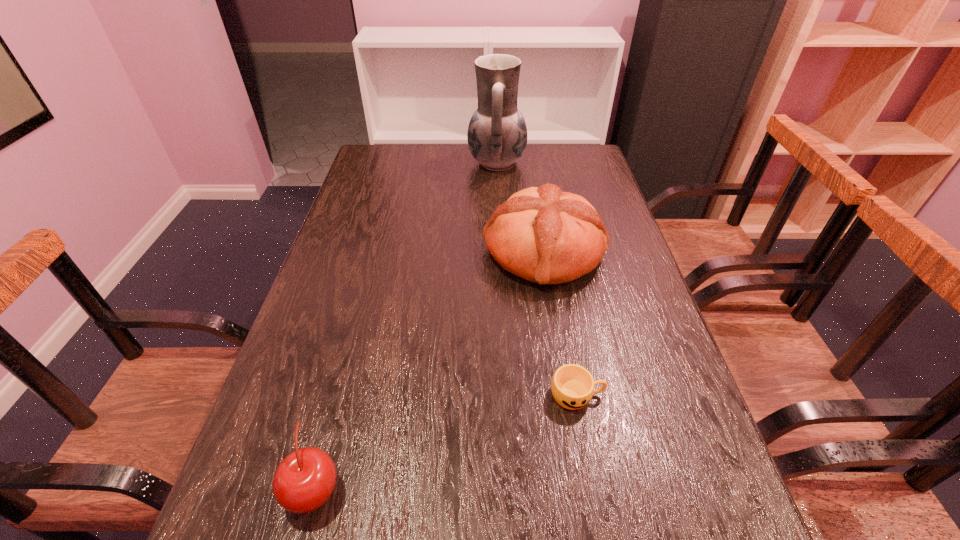
The height and width of the screenshot is (540, 960). Identify the location of vacant region that satisfies the following two spatial constraints: 1. on the back side of the second tallest object; 2. on the left side of the nearest object. (377, 252).

Find the location of a particular element. free space that satisfies the following two spatial constraints: 1. on the front-facing side of the cup; 2. on the right side of the tallest object is located at coordinates (510, 395).

The image size is (960, 540). I want to click on vacant region that satisfies the following two spatial constraints: 1. on the back side of the cup; 2. on the front-facing side of the tallest object, so click(x=535, y=163).

Where is `vacant space that satisfies the following two spatial constraints: 1. on the front-facing side of the tallest object; 2. on the left side of the third nearest object`? vacant space that satisfies the following two spatial constraints: 1. on the front-facing side of the tallest object; 2. on the left side of the third nearest object is located at coordinates (502, 252).

At what (x,y) coordinates should I click in order to perform the action: click on vacant area that satisfies the following two spatial constraints: 1. on the front-facing side of the tallest object; 2. on the front side of the leftmost object. Please return your answer as a coordinate pair (x, y). The width and height of the screenshot is (960, 540). Looking at the image, I should click on (515, 488).

Identify the location of free point that satisfies the following two spatial constraints: 1. on the front-facing side of the second farthest object; 2. on the right side of the farthest object. The height and width of the screenshot is (540, 960). (502, 252).

This screenshot has height=540, width=960. I want to click on free spot that satisfies the following two spatial constraints: 1. on the front-facing side of the tallest object; 2. on the left side of the third nearest object, so click(502, 252).